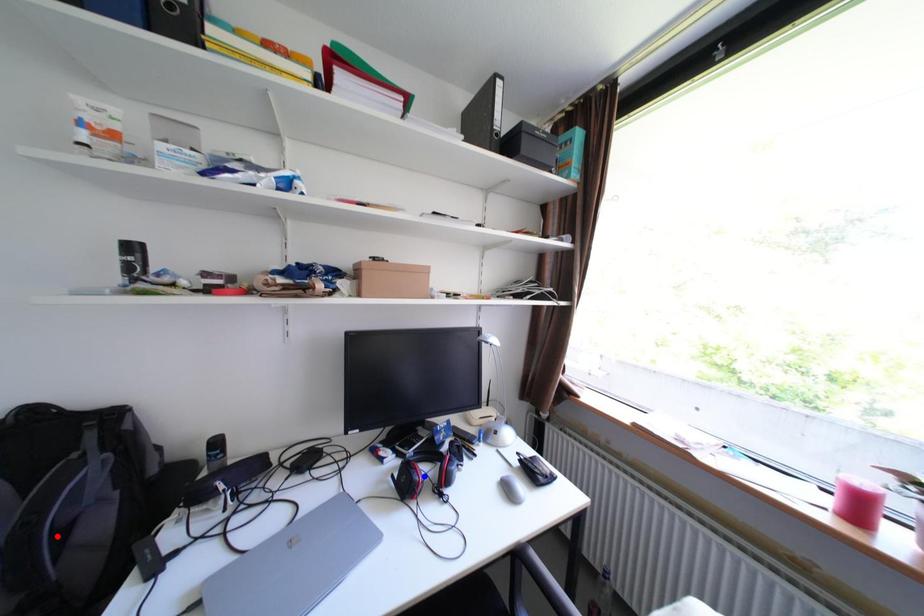
Question: In the image, two points are highlighted. Which point is nearer to the camera? Reply with the corresponding letter.

Choices:
 (A) blue point
 (B) red point

Answer: (B)